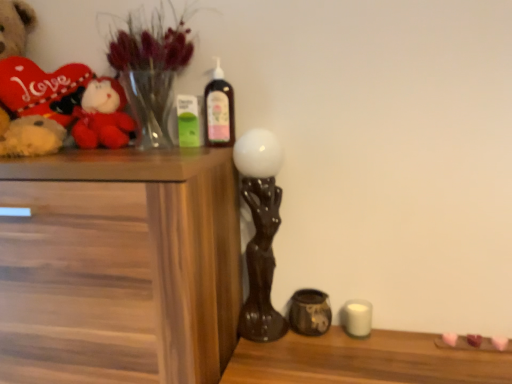
Question: Is white matte candle at lower right wider than matte brown ceramic jar at lower center, the 1th candle holder from the right?

Choices:
 (A) no
 (B) yes

Answer: (A)

Question: Considering the relative positions of white matte candle at lower right and matte brown ceramic jar at lower center, the 1th candle holder from the right, in the image provided, is white matte candle at lower right to the right of matte brown ceramic jar at lower center, the 1th candle holder from the right, from the viewer's perspective?

Choices:
 (A) yes
 (B) no

Answer: (A)

Question: Is white matte candle at lower right positioned before matte brown ceramic jar at lower center, marked as the 2th candle holder in a left-to-right arrangement?

Choices:
 (A) no
 (B) yes

Answer: (A)

Question: Are white matte candle at lower right and matte brown ceramic jar at lower center, the 1th candle holder from the right, beside each other?

Choices:
 (A) no
 (B) yes

Answer: (B)

Question: From a real-world perspective, is white matte candle at lower right on matte brown ceramic jar at lower center, marked as the 2th candle holder in a left-to-right arrangement?

Choices:
 (A) yes
 (B) no

Answer: (B)

Question: Is white matte candle at lower right completely or partially outside of matte brown ceramic jar at lower center, the 1th candle holder from the right?

Choices:
 (A) yes
 (B) no

Answer: (A)

Question: Is matte brown ceramic jar at lower center, marked as the 2th candle holder in a left-to-right arrangement, looking in the opposite direction of wooden chest of drawers at left?

Choices:
 (A) yes
 (B) no

Answer: (B)

Question: Is wooden chest of drawers at left a part of matte brown ceramic jar at lower center, the 1th candle holder from the right?

Choices:
 (A) yes
 (B) no

Answer: (B)

Question: Considering the relative sizes of matte brown ceramic jar at lower center, marked as the 2th candle holder in a left-to-right arrangement, and wooden chest of drawers at left in the image provided, is matte brown ceramic jar at lower center, marked as the 2th candle holder in a left-to-right arrangement, shorter than wooden chest of drawers at left?

Choices:
 (A) no
 (B) yes

Answer: (B)

Question: Does matte brown ceramic jar at lower center, the 1th candle holder from the right, lie in front of wooden chest of drawers at left?

Choices:
 (A) no
 (B) yes

Answer: (A)

Question: From a real-world perspective, is matte brown ceramic jar at lower center, marked as the 2th candle holder in a left-to-right arrangement, physically below wooden chest of drawers at left?

Choices:
 (A) no
 (B) yes

Answer: (B)

Question: Are matte brown ceramic jar at lower center, marked as the 2th candle holder in a left-to-right arrangement, and wooden chest of drawers at left located far from each other?

Choices:
 (A) yes
 (B) no

Answer: (B)

Question: From the image's perspective, would you say matte black sculpture at center, placed as the 1th candle holder when sorted from left to right, is shown under wooden chest of drawers at left?

Choices:
 (A) no
 (B) yes

Answer: (A)